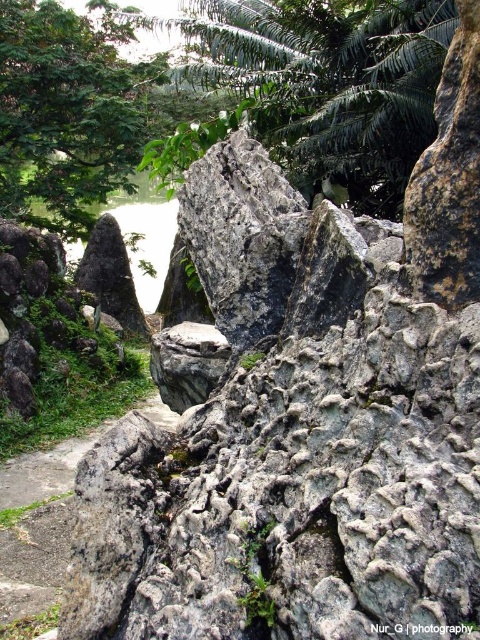
Who is taller, green leafy tree at upper center or green leafy tree at upper left?

With more height is green leafy tree at upper left.

Does green leafy tree at upper center appear under green leafy tree at upper left?

Indeed, green leafy tree at upper center is positioned under green leafy tree at upper left.

Find the location of `green leafy tree at upper center`. green leafy tree at upper center is located at coordinates (314, 88).

Find the location of a particular element. This screenshot has height=640, width=480. green leafy tree at upper center is located at coordinates tap(314, 88).